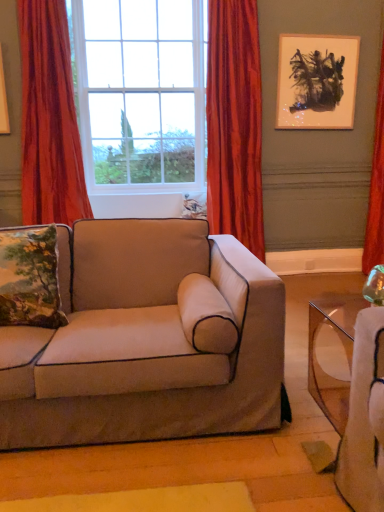
Question: From the image's perspective, is clear glass window at center under embroidered fabric pillow at left?

Choices:
 (A) yes
 (B) no

Answer: (B)

Question: Is clear glass window at center taller than embroidered fabric pillow at left?

Choices:
 (A) yes
 (B) no

Answer: (A)

Question: Is clear glass window at center smaller than embroidered fabric pillow at left?

Choices:
 (A) yes
 (B) no

Answer: (B)

Question: Is clear glass window at center wider than embroidered fabric pillow at left?

Choices:
 (A) yes
 (B) no

Answer: (A)

Question: Is embroidered fabric pillow at left surrounded by clear glass window at center?

Choices:
 (A) yes
 (B) no

Answer: (B)

Question: Considering the relative positions of clear glass window at center and embroidered fabric pillow at left in the image provided, is clear glass window at center in front of embroidered fabric pillow at left?

Choices:
 (A) yes
 (B) no

Answer: (B)

Question: Considering the relative positions of velvet orange curtain at left, which is the 3th curtain in right-to-left order, and matte black painting at upper right in the image provided, is velvet orange curtain at left, which is the 3th curtain in right-to-left order, to the left of matte black painting at upper right from the viewer's perspective?

Choices:
 (A) yes
 (B) no

Answer: (A)

Question: Is velvet orange curtain at left, which is the 3th curtain in right-to-left order, next to matte black painting at upper right and touching it?

Choices:
 (A) yes
 (B) no

Answer: (B)

Question: Is velvet orange curtain at left, which is the 3th curtain in right-to-left order, bigger than matte black painting at upper right?

Choices:
 (A) yes
 (B) no

Answer: (A)

Question: From the image's perspective, is velvet orange curtain at left, which is the 3th curtain in right-to-left order, below matte black painting at upper right?

Choices:
 (A) no
 (B) yes

Answer: (B)

Question: Considering the relative sizes of velvet orange curtain at left, which is the 3th curtain in right-to-left order, and matte black painting at upper right in the image provided, is velvet orange curtain at left, which is the 3th curtain in right-to-left order, smaller than matte black painting at upper right?

Choices:
 (A) yes
 (B) no

Answer: (B)

Question: Is velvet orange curtain at left, which is the 3th curtain in right-to-left order, located outside matte black painting at upper right?

Choices:
 (A) no
 (B) yes

Answer: (B)

Question: Considering the relative sizes of velvet-like red curtain at center, positioned as the second curtain in left-to-right order, and suede beige couch at center in the image provided, is velvet-like red curtain at center, positioned as the second curtain in left-to-right order, thinner than suede beige couch at center?

Choices:
 (A) no
 (B) yes

Answer: (B)